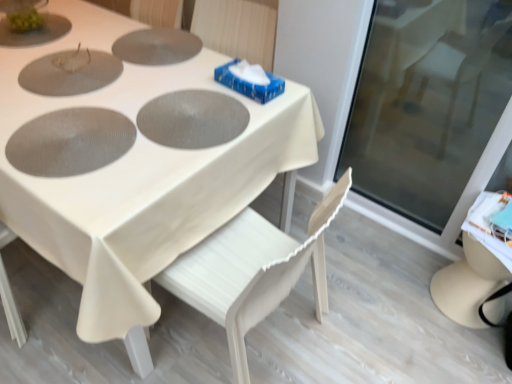
Locate an element on the screen. free area below matte gray pizza pan at upper center, the 1th pizza pan when ordered from back to front (from a real-world perspective) is located at coordinates (154, 44).